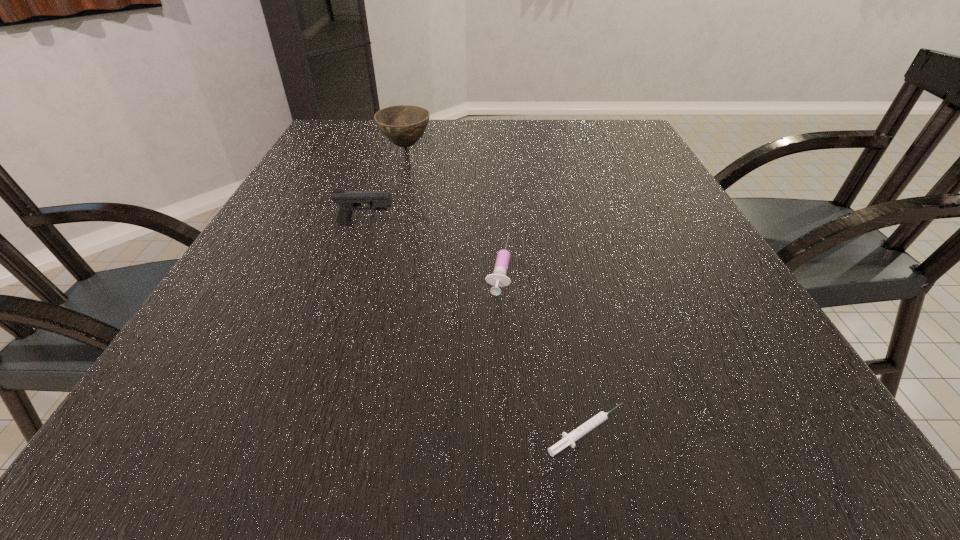
Locate an element on the screen. The width and height of the screenshot is (960, 540). vacant space that satisfies the following two spatial constraints: 1. on the front side of the nearest object; 2. on the left side of the third tallest object is located at coordinates (506, 431).

You are a GUI agent. You are given a task and a screenshot of the screen. Output one action in this format:
    pyautogui.click(x=<x>, y=<y>)
    Task: Click on the vacant position in the image that satisfies the following two spatial constraints: 1. on the front side of the farthest object; 2. on the left side of the third object from left to right
    This screenshot has height=540, width=960.
    Given the screenshot: What is the action you would take?
    pyautogui.click(x=371, y=266)

The height and width of the screenshot is (540, 960). Identify the location of free spot that satisfies the following two spatial constraints: 1. on the front side of the bowl; 2. at the barrel of the pistol. (383, 225).

Find the location of `blank area in the image that satisfies the following two spatial constraints: 1. on the front side of the farthest object; 2. on the left side of the nearest object`. blank area in the image that satisfies the following two spatial constraints: 1. on the front side of the farthest object; 2. on the left side of the nearest object is located at coordinates (323, 431).

You are a GUI agent. You are given a task and a screenshot of the screen. Output one action in this format:
    pyautogui.click(x=<x>, y=<y>)
    Task: Click on the free location that satisfies the following two spatial constraints: 1. on the back side of the shorter syringe; 2. at the barrel of the pistol
    
    Given the screenshot: What is the action you would take?
    pyautogui.click(x=546, y=225)

Find the location of a particular element. The height and width of the screenshot is (540, 960). free spot that satisfies the following two spatial constraints: 1. on the front side of the farthest object; 2. on the left side of the nearest object is located at coordinates (323, 431).

What are the coordinates of `blank area in the image that satisfies the following two spatial constraints: 1. at the barrel of the second object from right to left; 2. on the left side of the pistol` in the screenshot? It's located at (352, 266).

The width and height of the screenshot is (960, 540). Identify the location of vacant point that satisfies the following two spatial constraints: 1. at the barrel of the third tallest object; 2. on the left side of the second farthest object. (352, 266).